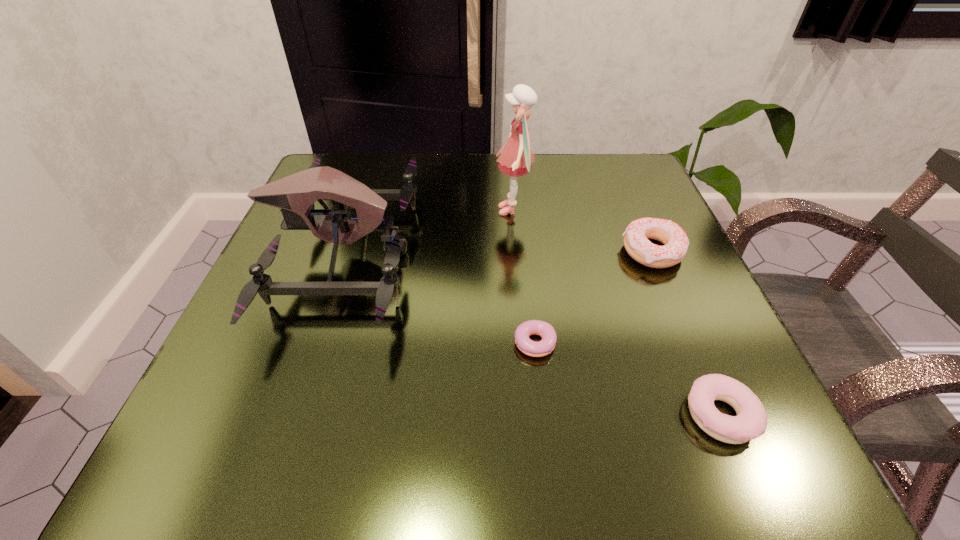
Find the location of a particular element. The width and height of the screenshot is (960, 540). vacant region located 0.260m on the front-facing side of the tallest object is located at coordinates (371, 210).

Locate an element on the screen. vacant space located 0.210m on the front-facing side of the tallest object is located at coordinates (395, 210).

The width and height of the screenshot is (960, 540). I want to click on free location located 0.050m on the front-facing side of the leftmost object, so click(440, 253).

At what (x,y) coordinates should I click in order to perform the action: click on vacant space located 0.190m on the front of the third shortest object. Please return your answer as a coordinate pair (x, y). This screenshot has height=540, width=960. Looking at the image, I should click on (699, 361).

In order to click on vacant position located 0.210m on the left of the nearest object in this screenshot , I will do `click(528, 414)`.

This screenshot has height=540, width=960. In order to click on vacant area situated 0.210m on the left of the leftmost doughnut in this screenshot , I will do `click(376, 347)`.

The height and width of the screenshot is (540, 960). I want to click on doll located in the far edge section of the desktop, so click(516, 159).

This screenshot has width=960, height=540. Identify the location of drone that is at the far edge. (295, 194).

Identify the location of object positioned at the near edge. Image resolution: width=960 pixels, height=540 pixels. (751, 421).

At what (x,y) coordinates should I click in order to perform the action: click on object located at the left edge. Please return your answer as a coordinate pair (x, y). Looking at the image, I should click on (295, 194).